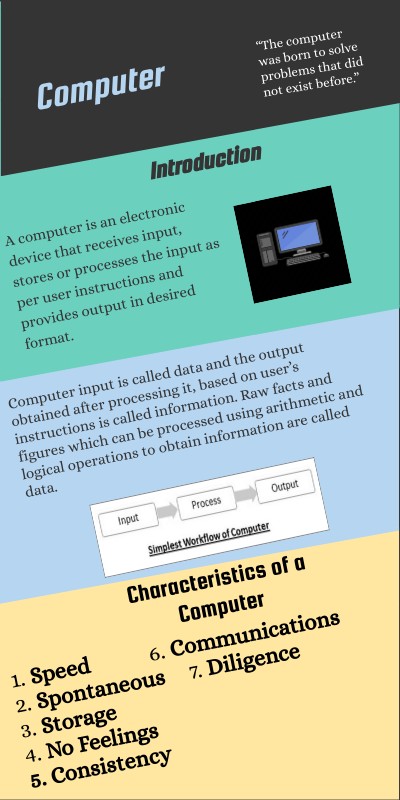
This screenshot has height=800, width=400. Identify the location of monitor. (298, 236).